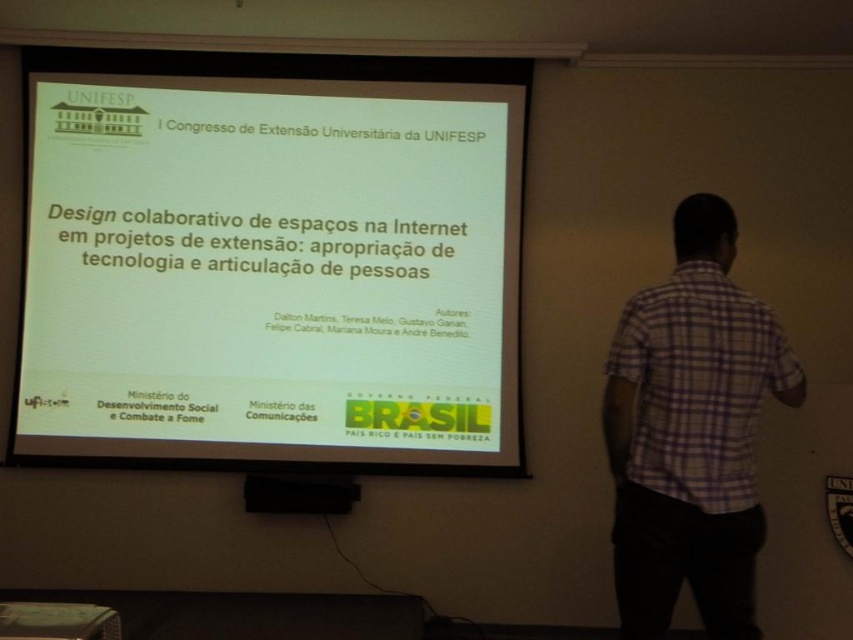
From the picture: You are a student sitting in the front row of the classroom. You need to look at the white matte projector screen at center and then glance at the purple checkered shirt at right. In which direction should you turn your head to look from the screen to the shirt?

The white matte projector screen at center is to the left of the purple checkered shirt at right, so you should turn your head to the right to look from the screen to the shirt.

You are an attendee at the presentation and want to take a photo of the slide on the white matte projector screen at center. However, you notice someone in a purple checkered shirt at right is standing in your way. Can you still capture the entire slide in your photo?

The white matte projector screen at center is much taller than the purple checkered shirt at right, so you can still capture the entire slide in your photo by adjusting your angle or position to avoid the obstruction caused by the purple checkered shirt at right.

You are an attendee in the presentation and you see two points on the screen. The first point is at coordinate point[27,348] and the second is at point[643,380]. From your perspective, which point is closer to the front of the screen?

Point[27,348] is behind point[643,380], so the point closer to the front of the screen is point[643,380].